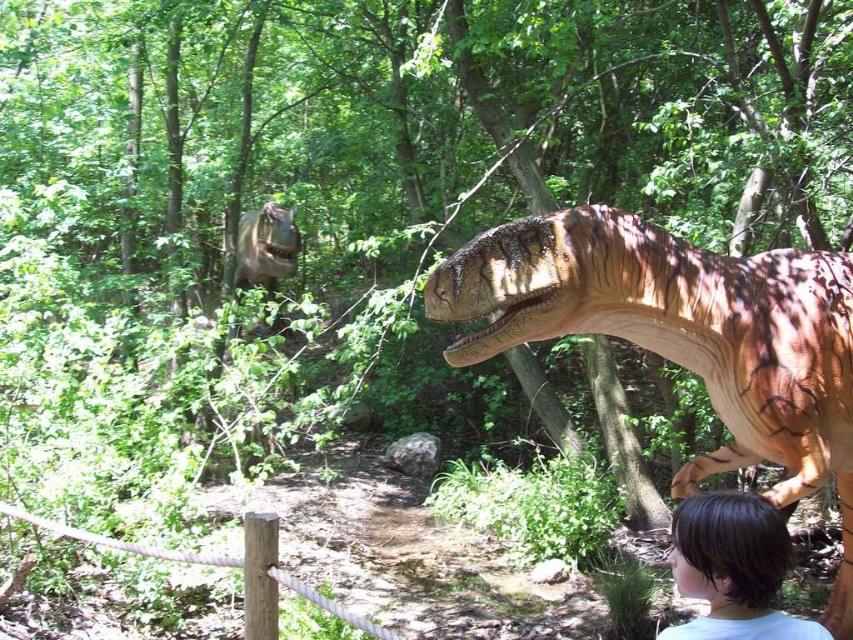
Question: Does brown hair at lower right come in front of brown rough wooden post at lower left?

Choices:
 (A) yes
 (B) no

Answer: (A)

Question: Which object is closer to the camera taking this photo?

Choices:
 (A) brown hair at lower right
 (B) brown rough wooden post at lower left
 (C) shiny metallic dinosaur at upper center
 (D) brown textured dinosaur at center

Answer: (A)

Question: Considering the relative positions of brown hair at lower right and brown rough wooden post at lower left in the image provided, where is brown hair at lower right located with respect to brown rough wooden post at lower left?

Choices:
 (A) left
 (B) right

Answer: (B)

Question: Is brown hair at lower right thinner than brown rough wooden post at lower left?

Choices:
 (A) no
 (B) yes

Answer: (A)

Question: Which of the following is the farthest from the observer?

Choices:
 (A) brown textured dinosaur at center
 (B) brown rough wooden post at lower left
 (C) brown hair at lower right

Answer: (A)

Question: Which point appears closest to the camera in this image?

Choices:
 (A) (248, 534)
 (B) (682, 564)
 (C) (265, 284)
 (D) (732, 358)

Answer: (B)